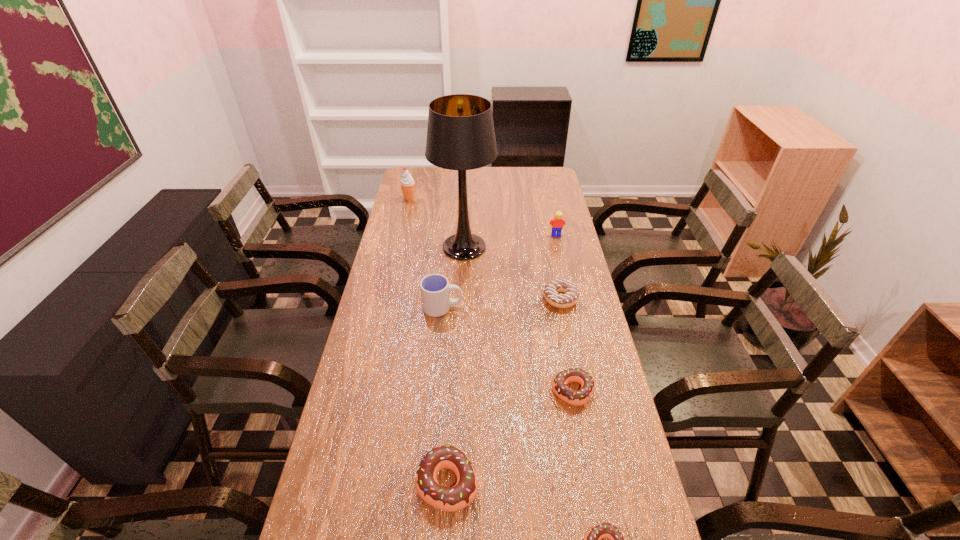
Where is `black table lamp`? The width and height of the screenshot is (960, 540). black table lamp is located at coordinates (460, 135).

Find the location of `the tallest object`. the tallest object is located at coordinates (460, 135).

Identify the location of icecream. (407, 183).

Identify the location of the leftmost object. The height and width of the screenshot is (540, 960). (407, 183).

I want to click on Lego, so click(x=557, y=223).

The height and width of the screenshot is (540, 960). What are the coordinates of `cup` in the screenshot? It's located at (435, 288).

Where is `the biggest brown doughnut`? The width and height of the screenshot is (960, 540). the biggest brown doughnut is located at coordinates (459, 496).

At what (x,y) coordinates should I click in order to perform the action: click on the leftmost doughnut. Please return your answer as a coordinate pair (x, y). The height and width of the screenshot is (540, 960). Looking at the image, I should click on (459, 496).

Find the location of a particular element. the second farthest doughnut is located at coordinates (569, 395).

Find the location of a particular element. This screenshot has width=960, height=540. the farthest brown doughnut is located at coordinates (569, 395).